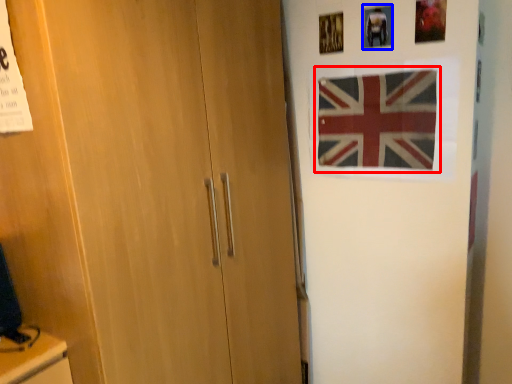
Question: Which of the following is the closest to the observer, flag (highlighted by a red box) or picture frame (highlighted by a blue box)?

Choices:
 (A) flag
 (B) picture frame

Answer: (A)